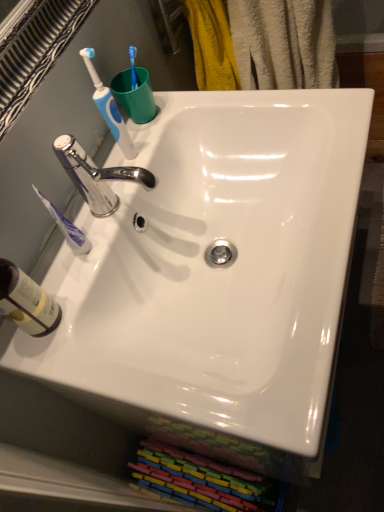
Question: Is white glossy sink at center inside blue plastic toothbrush at upper left, which is the first toothbrush from top to bottom?

Choices:
 (A) yes
 (B) no

Answer: (B)

Question: Is blue plastic toothbrush at upper left, which is the first toothbrush from top to bottom, positioned with its back to white glossy sink at center?

Choices:
 (A) yes
 (B) no

Answer: (B)

Question: Does blue plastic toothbrush at upper left, which is the first toothbrush from top to bottom, turn towards white glossy sink at center?

Choices:
 (A) yes
 (B) no

Answer: (B)

Question: From the image's perspective, is blue plastic toothbrush at upper left, which is the first toothbrush from top to bottom, on white glossy sink at center?

Choices:
 (A) no
 (B) yes

Answer: (B)

Question: From a real-world perspective, is blue plastic toothbrush at upper left, the second toothbrush positioned from the bottom, positioned over white glossy sink at center based on gravity?

Choices:
 (A) no
 (B) yes

Answer: (B)

Question: Would you say green plastic cup at upper center is inside or outside blue plastic toothbrush at upper left, which is the first toothbrush from top to bottom?

Choices:
 (A) inside
 (B) outside

Answer: (B)

Question: Looking at their shapes, would you say green plastic cup at upper center is wider or thinner than blue plastic toothbrush at upper left, the second toothbrush positioned from the bottom?

Choices:
 (A) wide
 (B) thin

Answer: (A)

Question: Does point (137, 122) appear closer or farther from the camera than point (125, 152)?

Choices:
 (A) farther
 (B) closer

Answer: (A)

Question: From their relative heights in the image, would you say green plastic cup at upper center is taller or shorter than blue plastic toothbrush at upper left, the second toothbrush positioned from the bottom?

Choices:
 (A) short
 (B) tall

Answer: (A)

Question: From the image's perspective, relative to white glossy sink at center, is white plastic toothbrush at left, which ranks as the first toothbrush in bottom-to-top order, above or below?

Choices:
 (A) above
 (B) below

Answer: (A)

Question: From a real-world perspective, relative to white glossy sink at center, is white plastic toothbrush at left, which is counted as the second toothbrush, starting from the top, vertically above or below?

Choices:
 (A) below
 (B) above

Answer: (B)

Question: Is white plastic toothbrush at left, which is counted as the second toothbrush, starting from the top, inside or outside of white glossy sink at center?

Choices:
 (A) outside
 (B) inside

Answer: (A)

Question: From their relative heights in the image, would you say white plastic toothbrush at left, which ranks as the first toothbrush in bottom-to-top order, is taller or shorter than white glossy sink at center?

Choices:
 (A) tall
 (B) short

Answer: (A)

Question: Is translucent plastic bottle at lower left taller or shorter than blue plastic toothbrush at upper left, which is the first toothbrush from top to bottom?

Choices:
 (A) tall
 (B) short

Answer: (B)

Question: Based on their sizes in the image, would you say translucent plastic bottle at lower left is bigger or smaller than blue plastic toothbrush at upper left, the second toothbrush positioned from the bottom?

Choices:
 (A) big
 (B) small

Answer: (A)